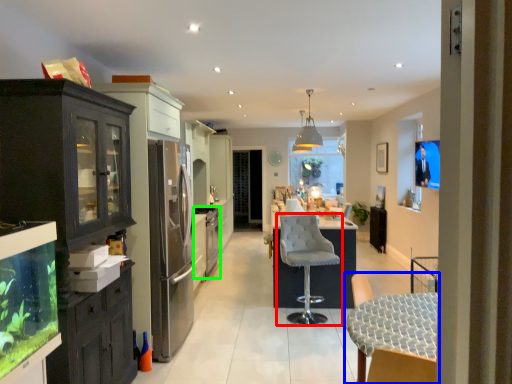
Question: Which object is the closest to the chair (highlighted by a red box)? Choose among these: chair (highlighted by a blue box) or appliance (highlighted by a green box).

Choices:
 (A) chair
 (B) appliance

Answer: (A)